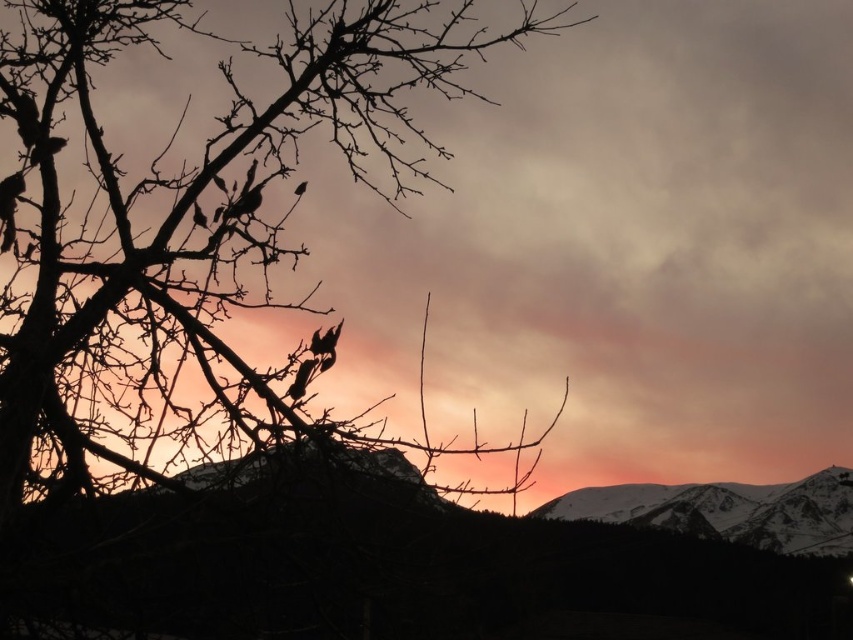
Based on the scene description, where is the silhouette branches at left positioned in the image?

The silhouette branches at left are positioned at point 0.350 on the x axis and 0.217 on the y axis.

You are an artist who wants to paint the sunset scene. You notice the silhouette branches at left and the snowy rocky mountain at lower right. Which object should you paint first if you follow the rule of painting taller objects before smaller ones?

You should paint the silhouette branches at left first because they are much taller than the snowy rocky mountain at lower right according to the description.

In the sunset scene, you want to place a small birdhouse between the silhouette branches at left and the snowy rocky mountain at lower right. Which object should the birdhouse be closer to if it needs to be placed closer to the narrower object?

The silhouette branches at left are narrower than the snowy rocky mountain at lower right. Therefore, the birdhouse should be placed closer to the silhouette branches at left.